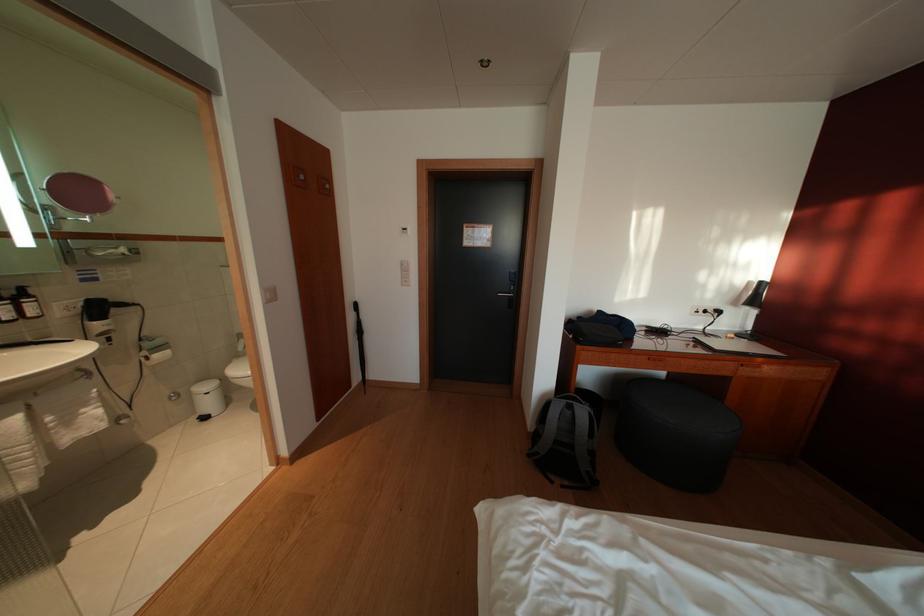
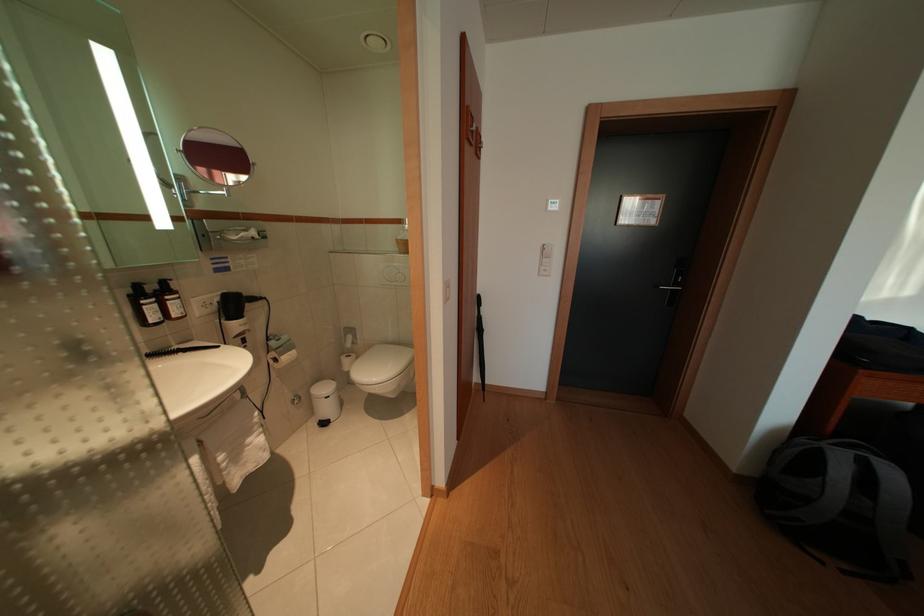
Where in the second image is the point corresponding to (590,419) from the first image?

(901, 480)